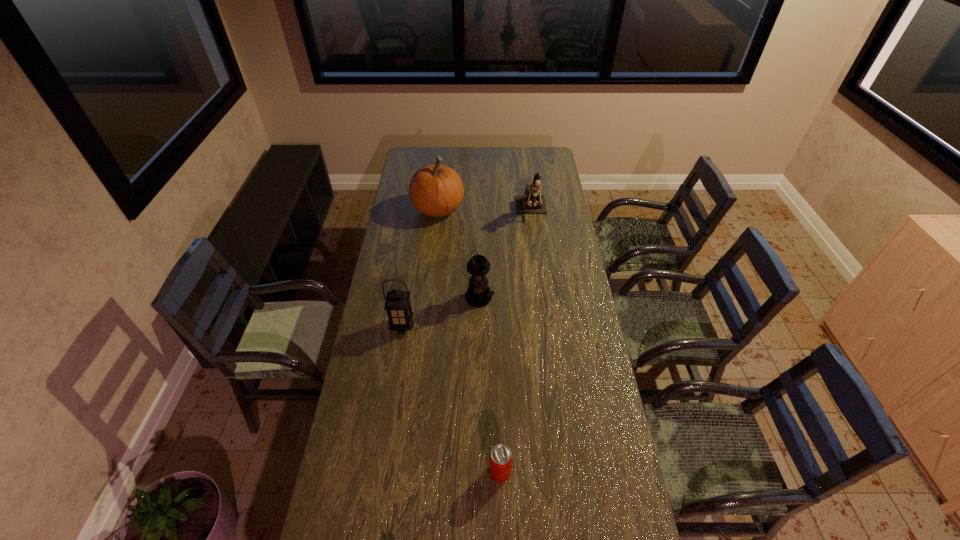
The image size is (960, 540). Identify the location of free space located 0.290m on the front of the fourth farthest object. (391, 403).

Locate the blank area located 0.220m above the third nearest object, indicating its light source in the image. Please provide its 2D coordinates. Your answer should be formatted as a tuple, i.e. [(x, y)], where the tuple contains the x and y coordinates of a point satisfying the conditions above.

[(546, 298)]

Find the location of a particular element. free space located 0.300m on the right of the can is located at coordinates (607, 472).

At what (x,y) coordinates should I click in order to perform the action: click on pumpkin located in the left edge section of the desktop. Please return your answer as a coordinate pair (x, y). The height and width of the screenshot is (540, 960). Looking at the image, I should click on (436, 190).

Locate an element on the screen. This screenshot has width=960, height=540. lantern positioned at the left edge is located at coordinates (397, 304).

Identify the location of object positioned at the right edge. This screenshot has height=540, width=960. (530, 203).

You are a GUI agent. You are given a task and a screenshot of the screen. Output one action in this format:
    pyautogui.click(x=<x>, y=<y>)
    Task: Click on the free space at the far edge
    This screenshot has height=540, width=960.
    Given the screenshot: What is the action you would take?
    pyautogui.click(x=478, y=152)

This screenshot has width=960, height=540. I want to click on free location at the left edge, so click(327, 538).

Identify the location of free space at the right edge of the desktop. (606, 428).

Image resolution: width=960 pixels, height=540 pixels. In order to click on free space between the third nearest object and the left lantern in this screenshot , I will do `click(441, 312)`.